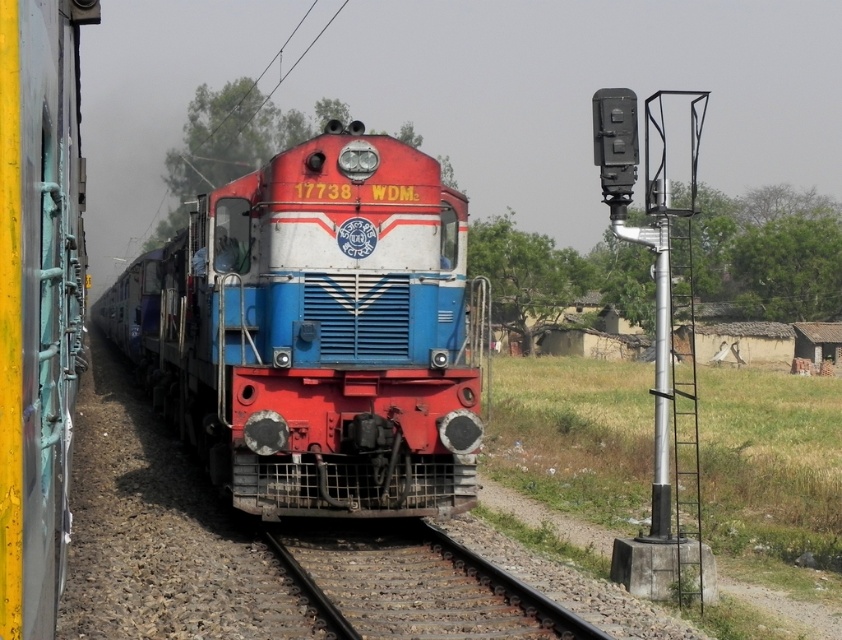
Between shiny red locomotive at center and rusty metal train track at center, which one is positioned lower?

Positioned lower is rusty metal train track at center.

Is shiny red locomotive at center closer to camera compared to rusty metal train track at center?

No, it is not.

Does point (387, 332) come behind point (361, 586)?

Yes, point (387, 332) is farther from viewer.

Find the location of `shiny red locomotive at center`. shiny red locomotive at center is located at coordinates (315, 332).